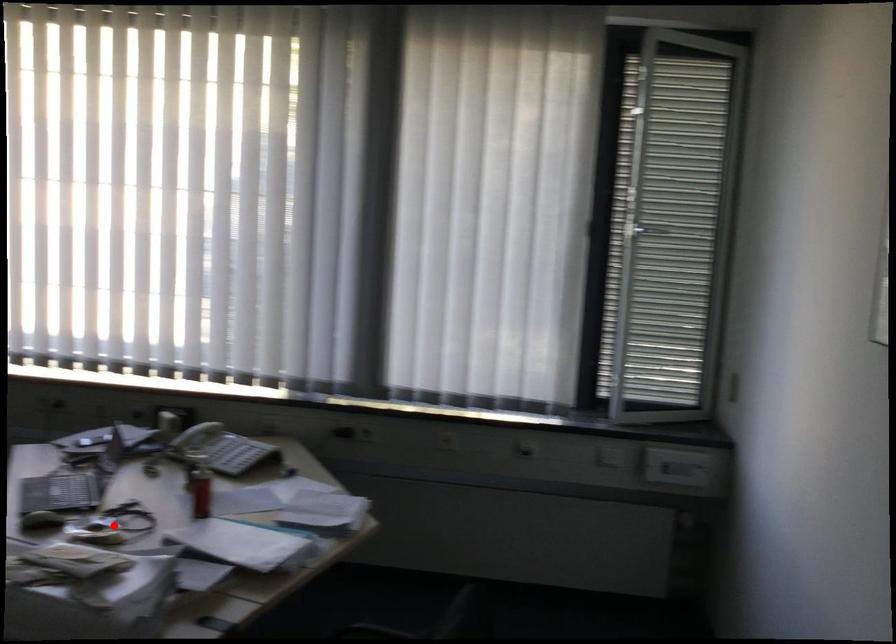
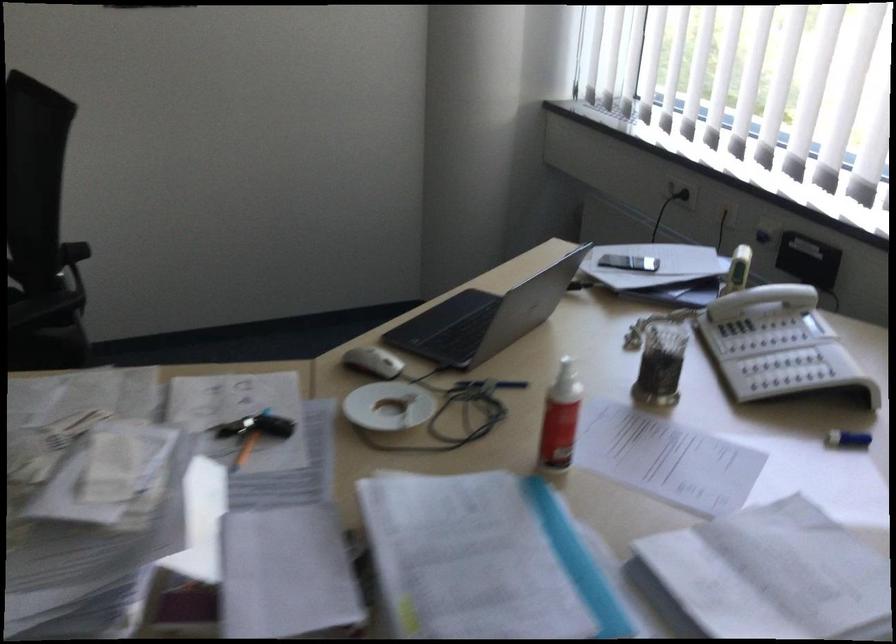
Question: I am providing you with two images of the same scene from different viewpoints. In image1, a red point is highlighted. Considering the same 3D point in image2, which of the following is correct?

Choices:
 (A) It is closer
 (B) It is farther

Answer: (A)